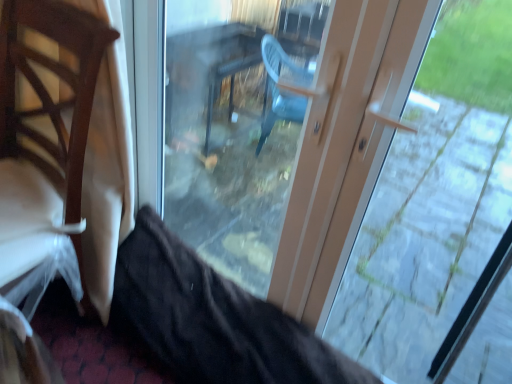
Question: Could matte plastic door at center be considered to be inside transparent glass door at center?

Choices:
 (A) yes
 (B) no

Answer: (A)

Question: Is transparent glass door at center taller than matte plastic door at center?

Choices:
 (A) yes
 (B) no

Answer: (B)

Question: Is transparent glass door at center oriented towards matte plastic door at center?

Choices:
 (A) yes
 (B) no

Answer: (A)

Question: Considering the relative sizes of transparent glass door at center and matte plastic door at center in the image provided, is transparent glass door at center bigger than matte plastic door at center?

Choices:
 (A) yes
 (B) no

Answer: (B)

Question: Considering the relative sizes of transparent glass door at center and matte plastic door at center in the image provided, is transparent glass door at center shorter than matte plastic door at center?

Choices:
 (A) yes
 (B) no

Answer: (A)

Question: Is point (65, 276) positioned closer to the camera than point (360, 284)?

Choices:
 (A) farther
 (B) closer

Answer: (B)

Question: In terms of width, does wooden chair at left look wider or thinner when compared to matte plastic door at center?

Choices:
 (A) wide
 (B) thin

Answer: (A)

Question: Is wooden chair at left bigger or smaller than matte plastic door at center?

Choices:
 (A) small
 (B) big

Answer: (B)

Question: From their relative heights in the image, would you say wooden chair at left is taller or shorter than matte plastic door at center?

Choices:
 (A) tall
 (B) short

Answer: (B)

Question: In the image, is matte plastic door at center positioned in front of or behind wooden chair at left?

Choices:
 (A) behind
 (B) front

Answer: (B)

Question: Is matte plastic door at center taller or shorter than wooden chair at left?

Choices:
 (A) short
 (B) tall

Answer: (B)

Question: Is matte plastic door at center wider or thinner than wooden chair at left?

Choices:
 (A) wide
 (B) thin

Answer: (B)

Question: Would you say matte plastic door at center is inside or outside wooden chair at left?

Choices:
 (A) outside
 (B) inside

Answer: (A)

Question: In terms of width, does matte plastic door at center look wider or thinner when compared to transparent glass door at center?

Choices:
 (A) thin
 (B) wide

Answer: (B)

Question: From their relative heights in the image, would you say matte plastic door at center is taller or shorter than transparent glass door at center?

Choices:
 (A) short
 (B) tall

Answer: (B)